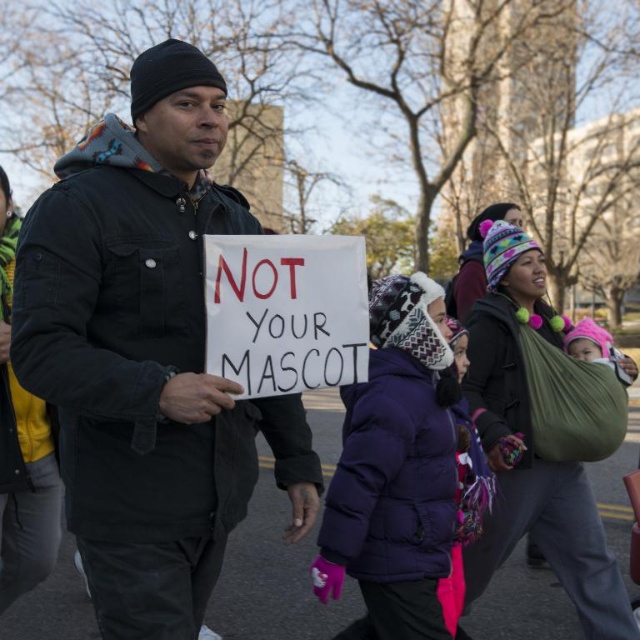
From the picture: Does matte black jacket at center have a greater height compared to purple puffy coat at center?

Yes.

Measure the distance between matte black jacket at center and camera.

matte black jacket at center and camera are 2.33 meters apart.

Between point (154, 532) and point (406, 588), which one is positioned in front?

Point (154, 532) is more forward.

Image resolution: width=640 pixels, height=640 pixels. I want to click on matte black jacket at center, so click(x=147, y=353).